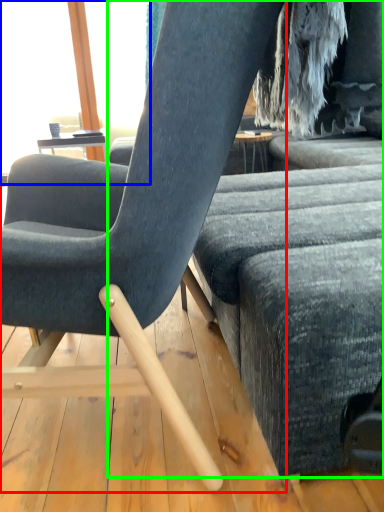
Question: Considering the real-world distances, which object is farthest from chair (highlighted by a red box)? window screen (highlighted by a blue box) or studio couch (highlighted by a green box)?

Choices:
 (A) window screen
 (B) studio couch

Answer: (A)